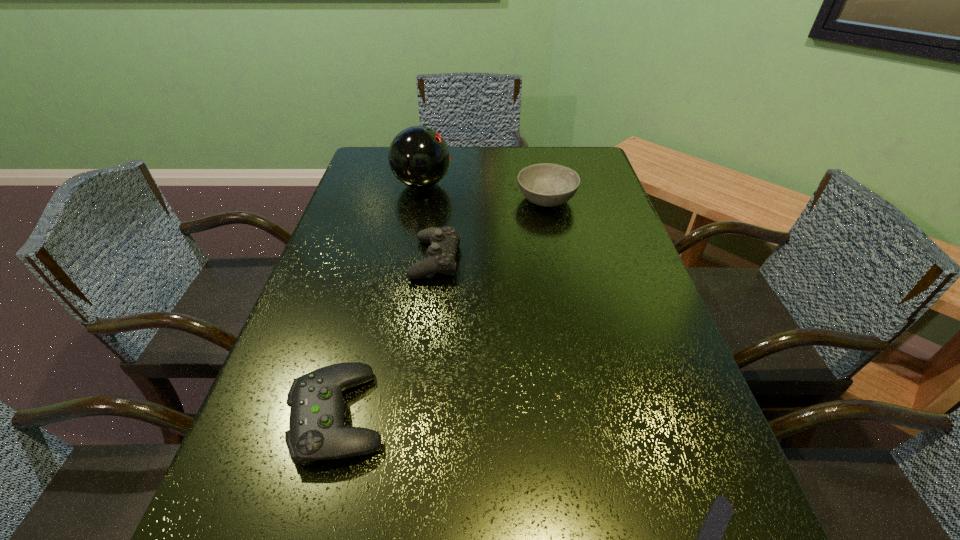
Identify the location of free space that is in between the bowling ball and the nearer control. Image resolution: width=960 pixels, height=540 pixels. (380, 300).

Find the location of a particular element. The image size is (960, 540). vacant space that is in between the bowling ball and the shorter control is located at coordinates (380, 300).

You are a GUI agent. You are given a task and a screenshot of the screen. Output one action in this format:
    pyautogui.click(x=<x>, y=<y>)
    Task: Click on the unoccupied area between the fourth farthest object and the third nearest object
    
    Given the screenshot: What is the action you would take?
    pyautogui.click(x=387, y=338)

This screenshot has width=960, height=540. What are the coordinates of `vacant space that is in between the bowl and the shorter control` in the screenshot? It's located at (443, 307).

The width and height of the screenshot is (960, 540). Identify the location of free space between the fourth farthest object and the bowl. (443, 307).

Identify which object is located as the third nearest to the third farthest object. Please provide its 2D coordinates. Your answer should be formatted as a tuple, i.e. [(x, y)], where the tuple contains the x and y coordinates of a point satisfying the conditions above.

[(316, 432)]

Where is `object that is the closest to the bowl`? object that is the closest to the bowl is located at coordinates (444, 241).

Where is `vacant region that satisfies the following two spatial constraints: 1. on the surface of the bowling ball near the finger holes; 2. on the left side of the taller control`? The image size is (960, 540). vacant region that satisfies the following two spatial constraints: 1. on the surface of the bowling ball near the finger holes; 2. on the left side of the taller control is located at coordinates (408, 259).

Where is `free space that satisfies the following two spatial constraints: 1. on the surface of the bowl near the finger holes; 2. on the left side of the bowling ball`? The height and width of the screenshot is (540, 960). free space that satisfies the following two spatial constraints: 1. on the surface of the bowl near the finger holes; 2. on the left side of the bowling ball is located at coordinates (420, 199).

You are a GUI agent. You are given a task and a screenshot of the screen. Output one action in this format:
    pyautogui.click(x=<x>, y=<y>)
    Task: Click on the free space that satisfies the following two spatial constraints: 1. on the surface of the bowl near the finger holes; 2. on the left side of the tallest object
    
    Given the screenshot: What is the action you would take?
    pyautogui.click(x=420, y=199)